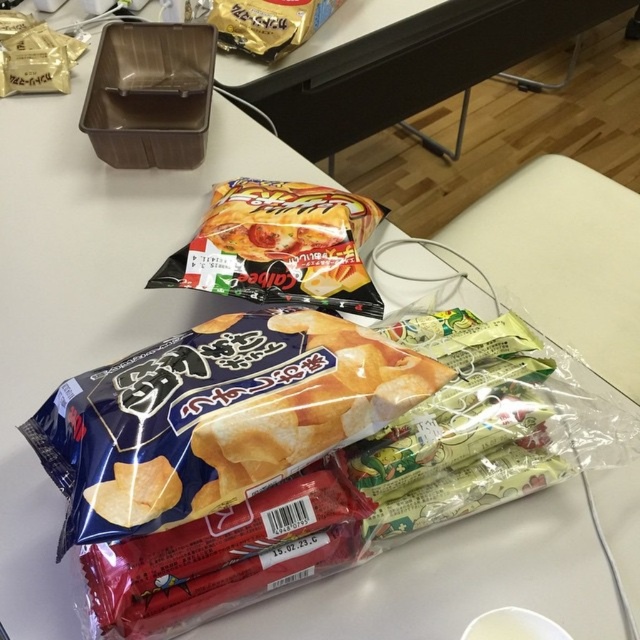
You are organizing snacks on a table and need to place a new snack between the shiny plastic bag of chips at center and the gold foil snack at upper center. Based on their positions, which snack should be on the left side of the new snack?

The gold foil snack at upper center should be on the left side of the new snack because the shiny plastic bag of chips at center is to the right of the gold foil snack at upper center.

You are organizing snacks on a table and see the shiny plastic bag of chips at center and the gold foil snack at upper center. Which snack is closer to you?

The shiny plastic bag of chips at center is closer because it is in front of the gold foil snack at upper center.